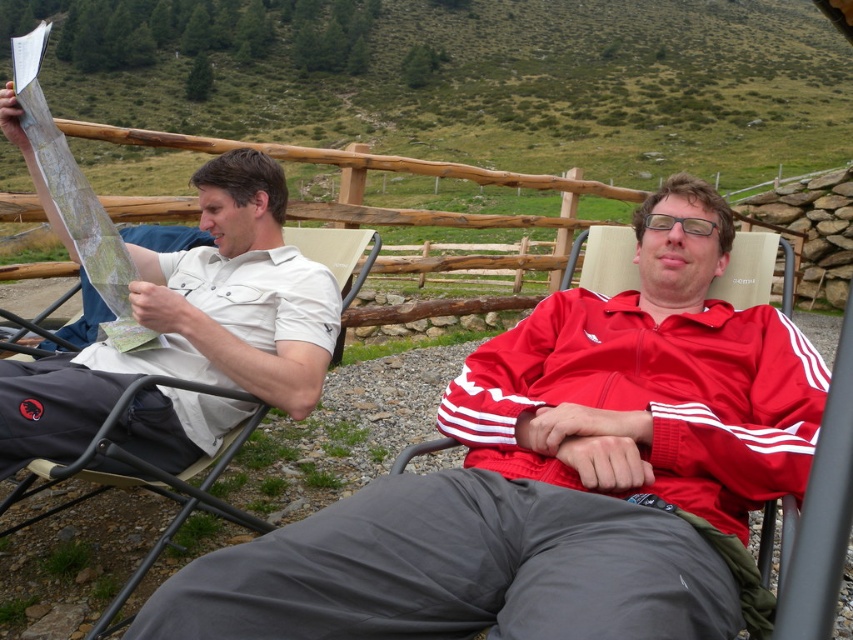
You are a drone operator trying to deliver a package to a person wearing a red synthetic jacket at center. The coordinates given are in a normalized system where the top left corner is the origin. What direction should you fly to reach the jacket?

The red synthetic jacket at center is located at coordinates point (558, 477). Since the coordinate system has the origin at the top left corner, this means the jacket is positioned 74.7 percent from the left edge and 65.5 percent from the top edge. To reach it, fly towards the lower right direction from the origin.

You are planning to place a new umbrella on the terrace. The red synthetic jacket at center is currently occupying the spot where you want to put it. Can you move the jacket to the beige fabric beach chair at left without moving the chair itself?

Yes, since the red synthetic jacket at center is to the right of the beige fabric beach chair at left, you can move the jacket to the chair without needing to move the chair itself.

You are planning to take a photo of the matte white shirt at left and the beige fabric beach chair at left. Which object should you focus on first if you want to capture both in the same frame without moving the camera?

The matte white shirt at left is bigger than the beige fabric beach chair at left, so you should focus on the matte white shirt at left first to ensure it is in clear view before adjusting for the smaller beige fabric beach chair at left.